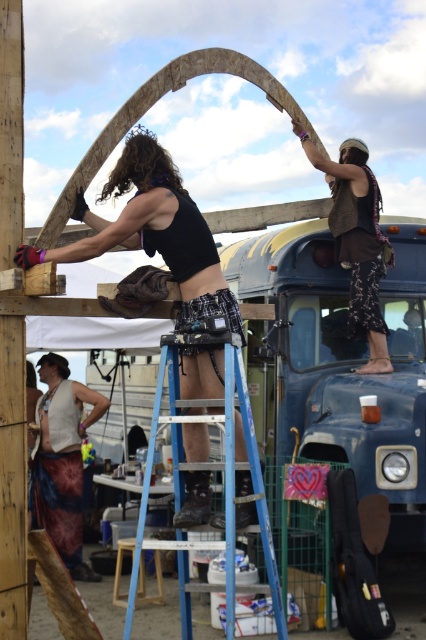
Question: Which of the following is the closest to the observer?

Choices:
 (A) (60, 364)
 (B) (161, 356)
 (C) (363, 282)
 (D) (120, 163)

Answer: (B)

Question: Can you confirm if blue metallic ladder at center is positioned to the left of brown leather vest at upper center?

Choices:
 (A) no
 (B) yes

Answer: (B)

Question: Which object is closer to the camera taking this photo?

Choices:
 (A) tie-dye fabric skirt at lower left
 (B) blue metallic ladder at center
 (C) matte black tank top at center

Answer: (B)

Question: Can you confirm if blue metallic ladder at center is positioned below brown leather vest at upper center?

Choices:
 (A) no
 (B) yes

Answer: (B)

Question: Can you confirm if blue metallic ladder at center is bigger than brown leather vest at upper center?

Choices:
 (A) no
 (B) yes

Answer: (B)

Question: Which point is farther to the camera?

Choices:
 (A) (183, 387)
 (B) (354, 250)
 (C) (187, 596)
 (D) (54, 497)

Answer: (D)